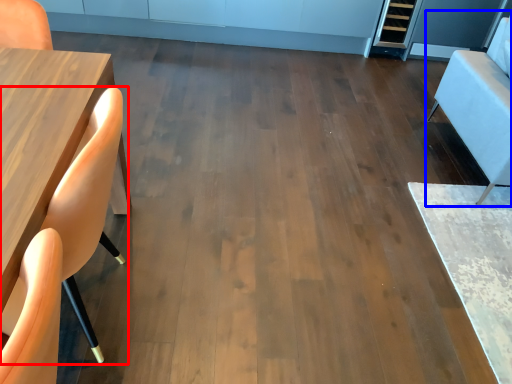
Question: Which object appears farthest to the camera in this image, chair (highlighted by a red box) or armchair (highlighted by a blue box)?

Choices:
 (A) chair
 (B) armchair

Answer: (B)